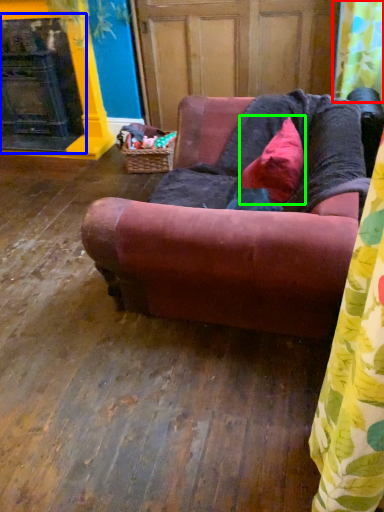
Question: Considering the real-world distances, which object is farthest from shower curtain (highlighted by a red box)? fireplace (highlighted by a blue box) or pillow (highlighted by a green box)?

Choices:
 (A) fireplace
 (B) pillow

Answer: (A)